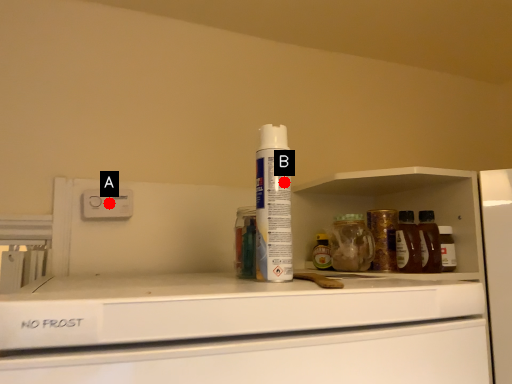
Question: Two points are circled on the image, labeled by A and B beside each circle. Among these points, which one is nearest to the camera?

Choices:
 (A) A is closer
 (B) B is closer

Answer: (B)